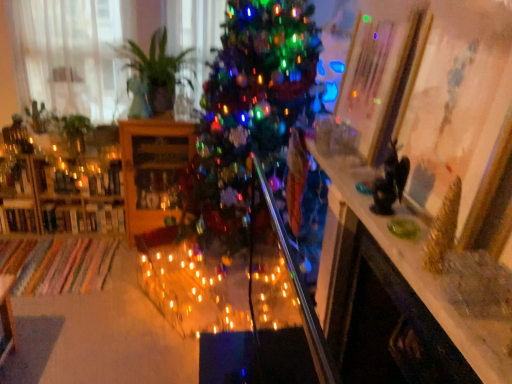
Question: From a real-world perspective, is wooden cabinet at center, the first shelf in the right-to-left sequence, positioned under green leafy plant at left based on gravity?

Choices:
 (A) no
 (B) yes

Answer: (B)

Question: Can you confirm if wooden cabinet at center, positioned as the second shelf in left-to-right order, is positioned to the right of green leafy plant at left?

Choices:
 (A) yes
 (B) no

Answer: (A)

Question: Does wooden cabinet at center, the first shelf in the right-to-left sequence, contain green leafy plant at left?

Choices:
 (A) no
 (B) yes

Answer: (A)

Question: Is wooden cabinet at center, the first shelf in the right-to-left sequence, looking in the opposite direction of green leafy plant at left?

Choices:
 (A) yes
 (B) no

Answer: (B)

Question: From the image's perspective, would you say wooden cabinet at center, positioned as the second shelf in left-to-right order, is shown under green leafy plant at left?

Choices:
 (A) no
 (B) yes

Answer: (B)

Question: Is wooden cabinet at center, positioned as the second shelf in left-to-right order, further to the viewer compared to green leafy plant at left?

Choices:
 (A) yes
 (B) no

Answer: (B)

Question: Is green glossy plant at upper left facing towards shiny green christmas tree at center?

Choices:
 (A) yes
 (B) no

Answer: (B)

Question: Does green glossy plant at upper left have a lesser width compared to shiny green christmas tree at center?

Choices:
 (A) yes
 (B) no

Answer: (A)

Question: Are green glossy plant at upper left and shiny green christmas tree at center located far from each other?

Choices:
 (A) yes
 (B) no

Answer: (B)

Question: From a real-world perspective, is green glossy plant at upper left located beneath shiny green christmas tree at center?

Choices:
 (A) yes
 (B) no

Answer: (B)

Question: Is shiny green christmas tree at center at the back of green glossy plant at upper left?

Choices:
 (A) no
 (B) yes

Answer: (A)

Question: Does green glossy plant at upper left have a greater height compared to shiny green christmas tree at center?

Choices:
 (A) yes
 (B) no

Answer: (B)

Question: From the image's perspective, is green glossy plant at upper left over white sheer curtain at left?

Choices:
 (A) no
 (B) yes

Answer: (A)